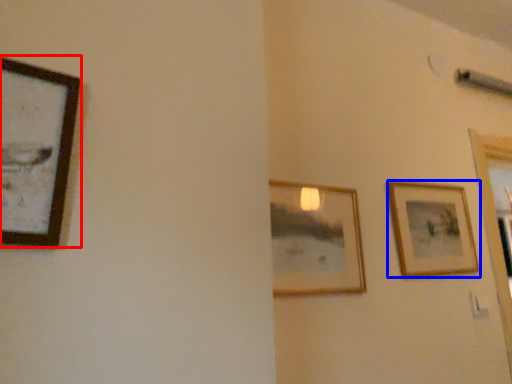
Question: Which point is further to the camera, picture frame (highlighted by a red box) or picture frame (highlighted by a blue box)?

Choices:
 (A) picture frame
 (B) picture frame

Answer: (B)